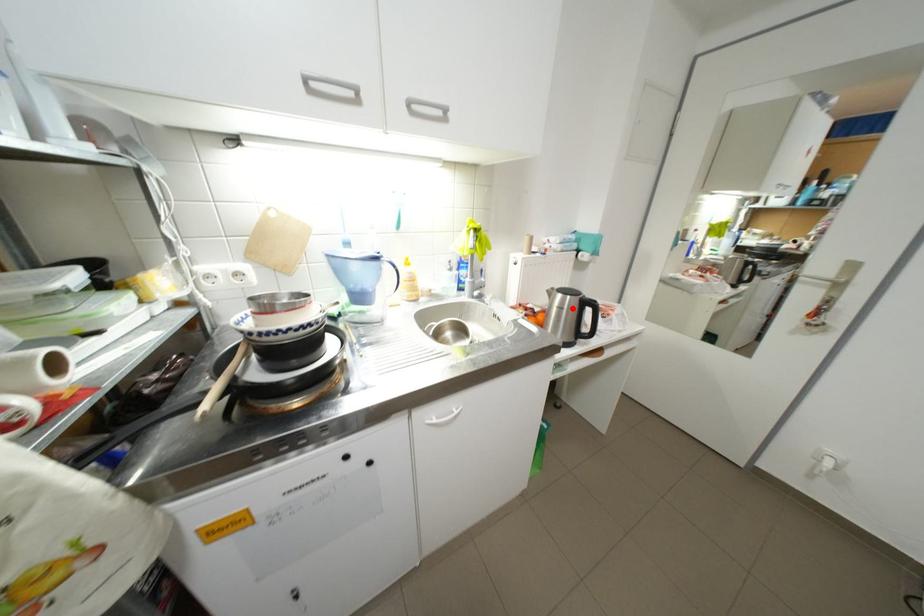
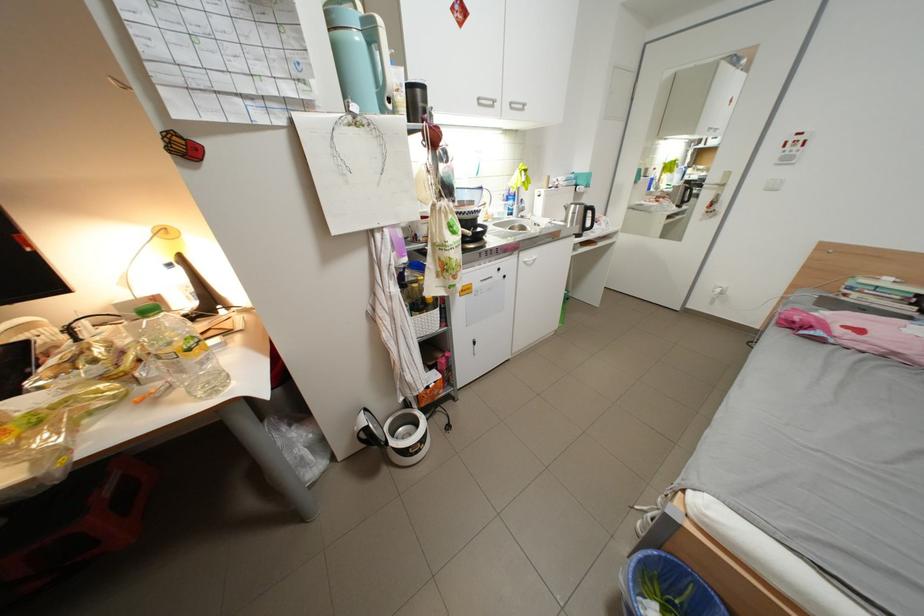
Question: I am providing you with two images of the same scene from different viewpoints. A red point is shown in image1. For the corresponding object point in image2, is it positioned nearer or farther from the camera?

Choices:
 (A) Nearer
 (B) Farther

Answer: (A)